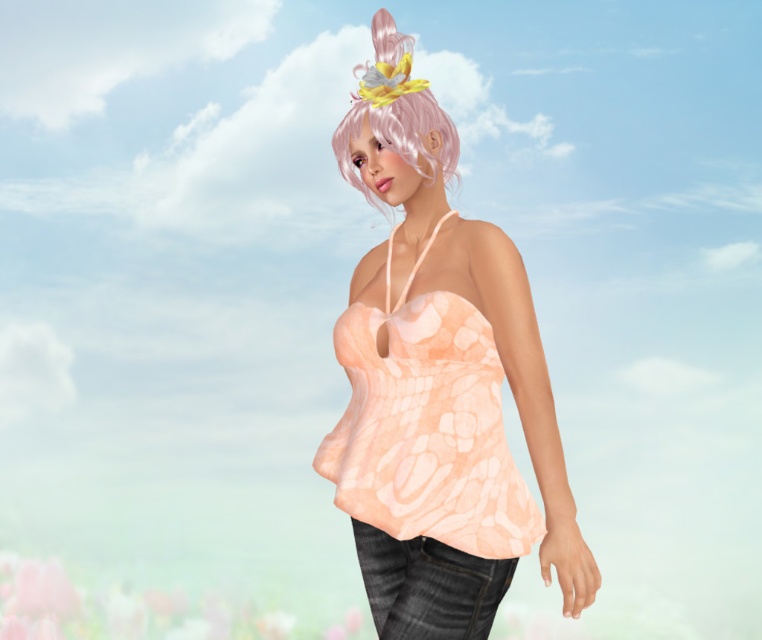
The user is trying to decide between wearing the peachy fabric top at center or the pastel peach fabric dress at center for an event. Based on the image description, which one is currently visible on the person?

The peachy fabric top at center is positioned over the pastel peach fabric dress at center, so the top is visible while the dress is underneath.

You are a fashion designer observing the person in the image. You need to determine which item of clothing or accessory takes up more visual space in the image. Which one is larger in size between the peachy fabric top at center and the pink matte wig at upper center?

The peachy fabric top at center is larger in size than the pink matte wig at upper center, so the peachy fabric top at center takes up more visual space in the image.